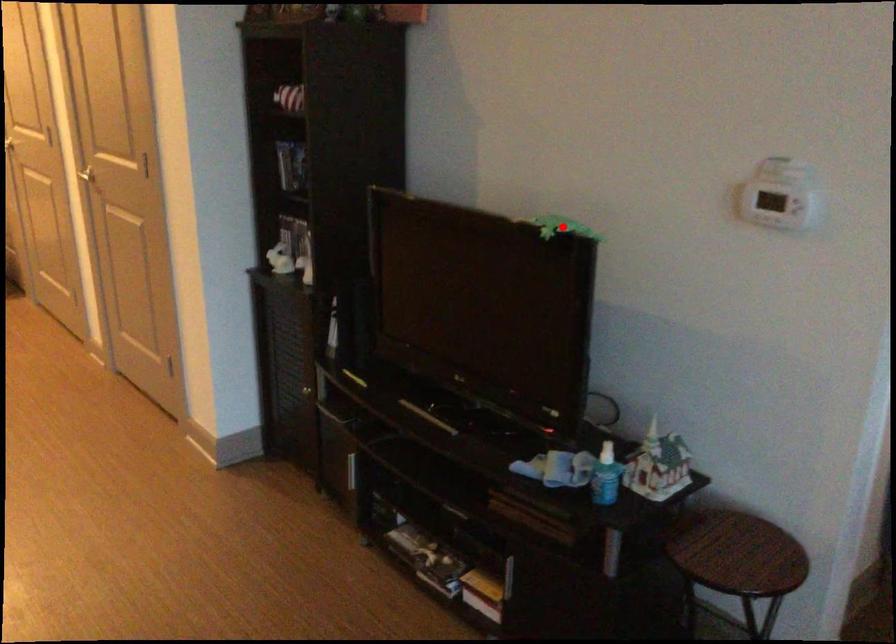
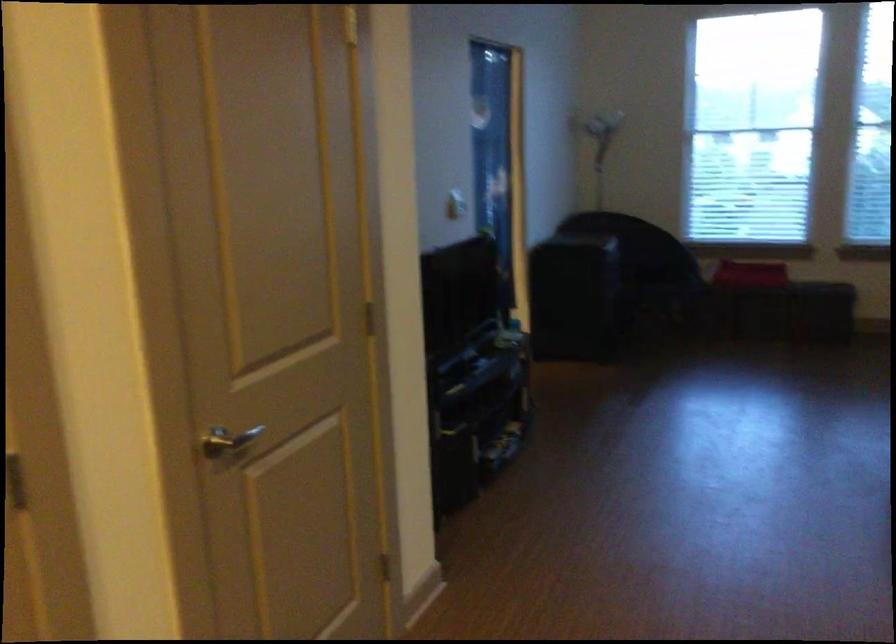
Question: I am providing you with two images of the same scene from different viewpoints. A red point is marked on the first image. Can you still see the location of the red point in image 2?

Choices:
 (A) Yes
 (B) No

Answer: (B)